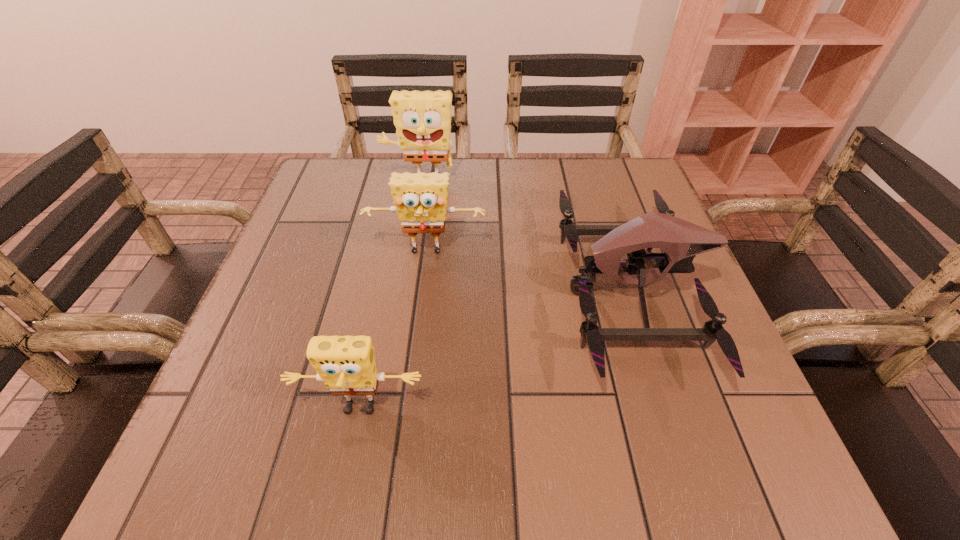
I want to click on object that is at the far edge, so click(422, 119).

This screenshot has width=960, height=540. I want to click on object that is at the near edge, so click(x=346, y=364).

Identify the location of object that is at the left edge. (346, 364).

Find the location of a particular element. This screenshot has height=540, width=960. object at the right edge is located at coordinates (680, 240).

Identify the location of object located in the near left corner section of the desktop. The height and width of the screenshot is (540, 960). (346, 364).

At what (x,y) coordinates should I click in order to perform the action: click on vacant region at the far edge of the desktop. Please return your answer as a coordinate pair (x, y). Looking at the image, I should click on (467, 208).

At what (x,y) coordinates should I click in order to perform the action: click on free space at the near edge. Please return your answer as a coordinate pair (x, y). The width and height of the screenshot is (960, 540). Looking at the image, I should click on (458, 463).

In the image, there is a desktop. What are the coordinates of `free region at the left edge` in the screenshot? It's located at (264, 313).

Identify the location of vacant space at the far left corner of the desktop. This screenshot has height=540, width=960. (325, 201).

Locate an element on the screen. The height and width of the screenshot is (540, 960). unoccupied position between the farthest sponge and the nearest sponge is located at coordinates (390, 295).